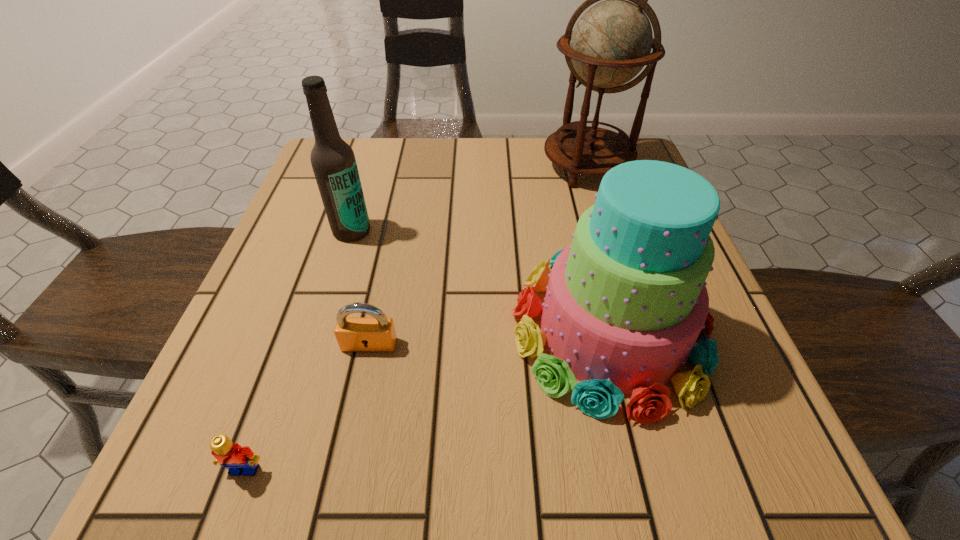
At what (x,y) coordinates should I click in order to perform the action: click on vacant space in between the tallest object and the second farthest object. Please return your answer as a coordinate pair (x, y). The width and height of the screenshot is (960, 540). Looking at the image, I should click on (469, 199).

What are the coordinates of `vacant space in between the tallest object and the third object from left to right` in the screenshot? It's located at (x=478, y=255).

The width and height of the screenshot is (960, 540). Find the location of `object that ranks as the second closest to the cake`. object that ranks as the second closest to the cake is located at coordinates (611, 43).

Identify the location of the third closest object to the Lego. Image resolution: width=960 pixels, height=540 pixels. (333, 161).